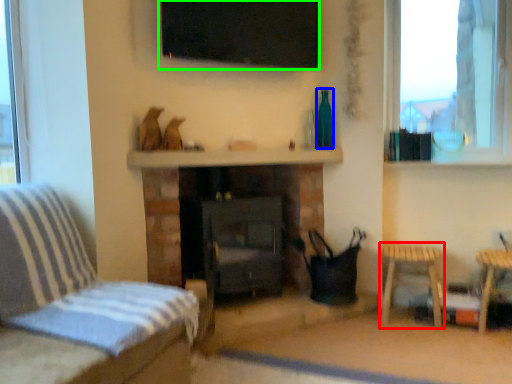
Question: Which is farther away from table (highlighted by a red box)? bottle (highlighted by a blue box) or window screen (highlighted by a green box)?

Choices:
 (A) bottle
 (B) window screen

Answer: (B)